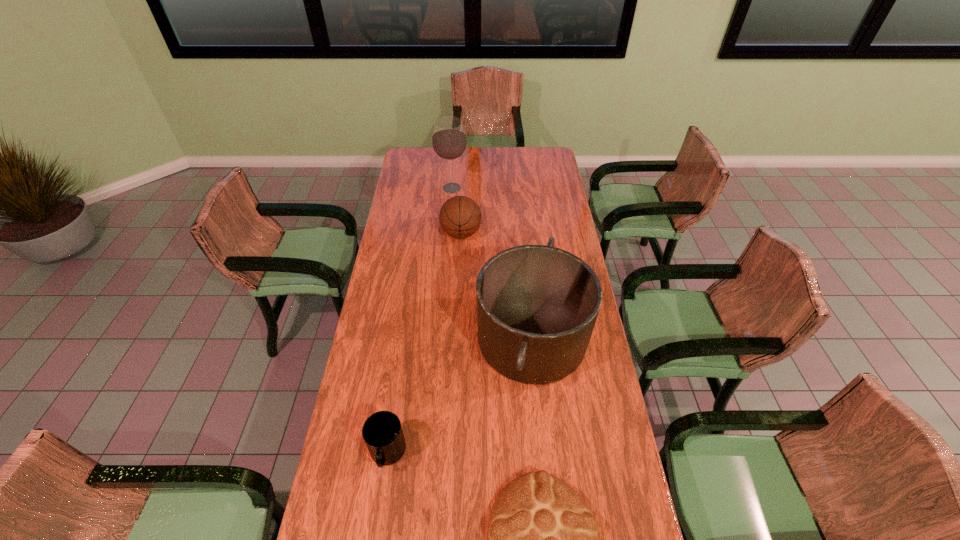
Where is `the third closest object to the bread`? the third closest object to the bread is located at coordinates (460, 217).

You are a GUI agent. You are given a task and a screenshot of the screen. Output one action in this format:
    pyautogui.click(x=<x>, y=<y>)
    Task: Click on the object that is the closest to the bread
    This screenshot has height=540, width=960.
    Given the screenshot: What is the action you would take?
    pyautogui.click(x=537, y=305)

At what (x,y) coordinates should I click in order to perform the action: click on vacant region that satisfies the following two spatial constraints: 1. on the back side of the pan; 2. on the side with brand label of the fourth nearest object. Please return your answer as a coordinate pair (x, y). This screenshot has height=540, width=960. Looking at the image, I should click on (521, 233).

What are the coordinates of `vacant point that satisfies the following two spatial constraints: 1. on the side with brand label of the basketball; 2. on the side of the mug with the handle` in the screenshot? It's located at [451, 454].

In order to click on vacant area in the image that satisfies the following two spatial constraints: 1. on the back side of the third nearest object; 2. on the side with brand label of the third tallest object in this screenshot , I will do `click(521, 233)`.

Identify the location of vacant position in the image that satisfies the following two spatial constraints: 1. on the side with brand label of the third farthest object; 2. on the right side of the fourth nearest object. (456, 339).